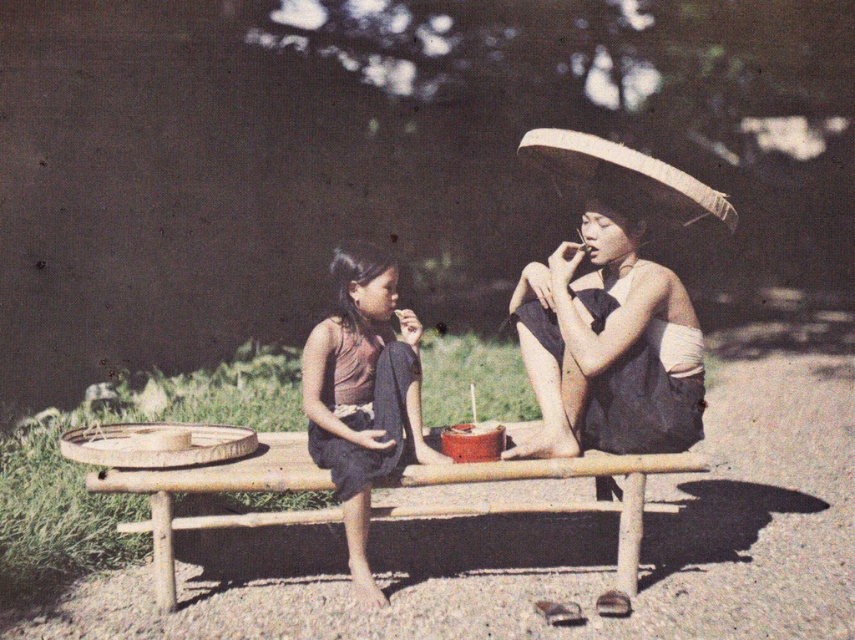
You are planning to take a photo of the two people sitting on the wooden bench. To ensure both the natural straw hat at upper right and the brown matte dress at center are clearly visible in the frame, should you adjust your camera angle to look more towards the front or the back of the scene?

Since the natural straw hat at upper right is behind the brown matte dress at center, you should adjust your camera angle to look more towards the front of the scene to ensure both objects are clearly visible.

You are planning to pack a bag for a picnic and need to decide between the brown matte dress at center and the natural straw hat at upper right. Which item is smaller and would take up less space?

The brown matte dress at center has a smaller size compared to the natural straw hat at upper right, so it would take up less space.